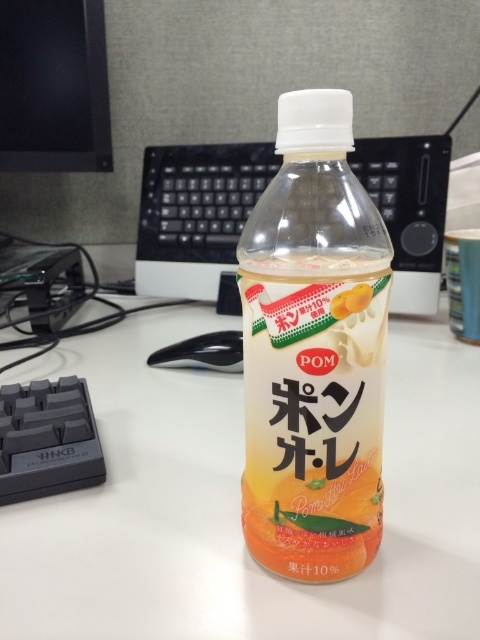
How distant is white plastic table at center from black plastic keyboard at lower left?

white plastic table at center is 21.11 centimeters away from black plastic keyboard at lower left.

Is white plastic table at center below black plastic keyboard at lower left?

No.

Locate an element on the screen. Image resolution: width=480 pixels, height=640 pixels. white plastic table at center is located at coordinates (239, 502).

Who is positioned more to the right, translucent plastic bottle at center or transparent plastic bottle at center?

From the viewer's perspective, transparent plastic bottle at center appears more on the right side.

Between point (305, 100) and point (238, 189), which one is positioned in front?

Positioned in front is point (305, 100).

Locate an element on the screen. The width and height of the screenshot is (480, 640). translucent plastic bottle at center is located at coordinates (312, 352).

Which is in front, point (276, 552) or point (360, 308)?

Point (360, 308) is more forward.

This screenshot has height=640, width=480. Describe the element at coordinates (312, 352) in the screenshot. I see `translucent plastic bottle at center` at that location.

You are a GUI agent. You are given a task and a screenshot of the screen. Output one action in this format:
    pyautogui.click(x=<x>, y=<y>)
    Task: Click on the translucent plastic bottle at center
    This screenshot has height=640, width=480.
    Given the screenshot: What is the action you would take?
    coord(312,352)